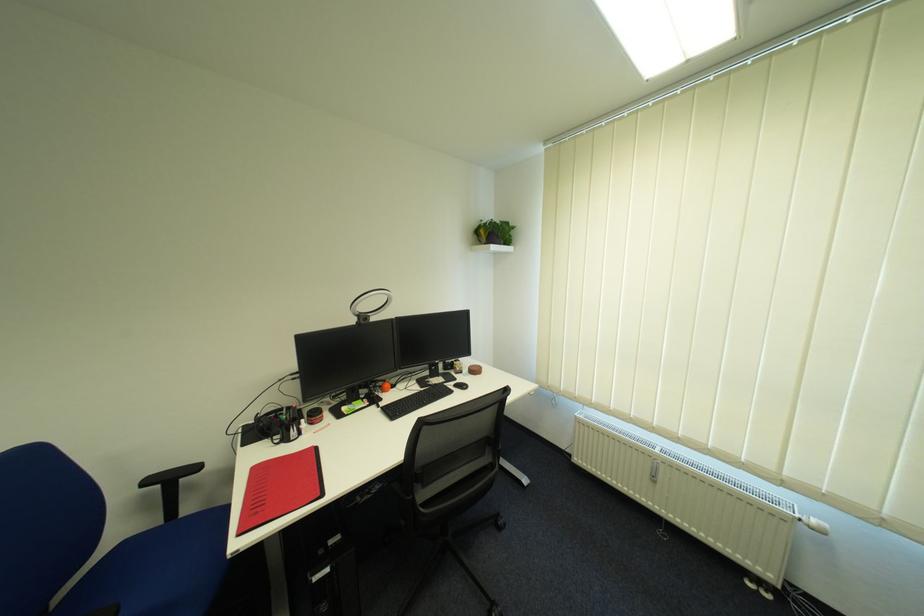
Find the location of `black chair sitting surface`. black chair sitting surface is located at coordinates (465, 485).